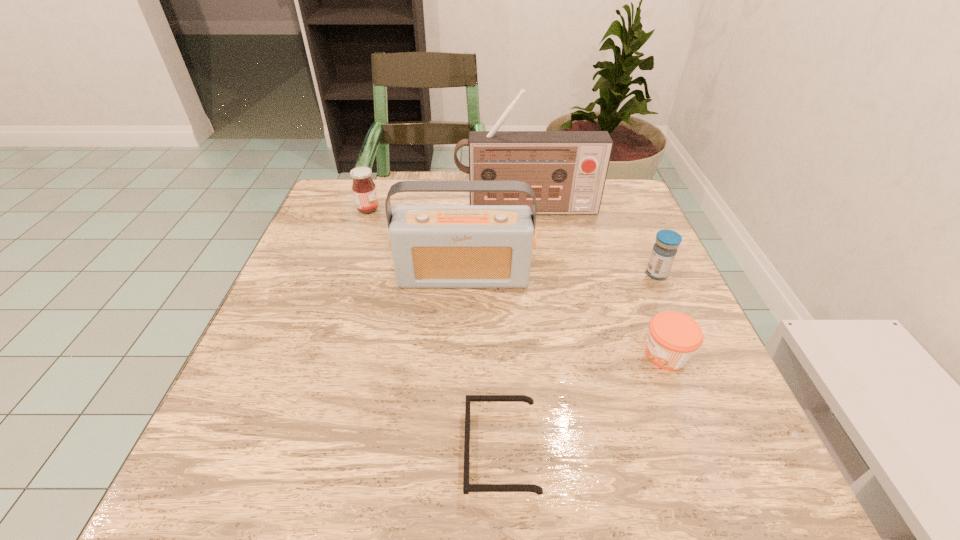
The width and height of the screenshot is (960, 540). Identify the location of the taller radio receiver. (567, 170).

This screenshot has height=540, width=960. I want to click on the farther radio receiver, so coord(567,170).

Where is `the second tallest object`? the second tallest object is located at coordinates (433, 246).

Image resolution: width=960 pixels, height=540 pixels. I want to click on the nearer radio receiver, so click(x=433, y=246).

The width and height of the screenshot is (960, 540). Identify the location of the taller jam. (364, 190).

Locate an element on the screen. The height and width of the screenshot is (540, 960). the left jam is located at coordinates (364, 190).

This screenshot has width=960, height=540. I want to click on medicine, so click(664, 251).

Identify the location of the right jam. This screenshot has width=960, height=540. (673, 338).

Where is `the second shortest object`? the second shortest object is located at coordinates (673, 338).

The image size is (960, 540). Find the location of `the nearest object`. the nearest object is located at coordinates (467, 487).